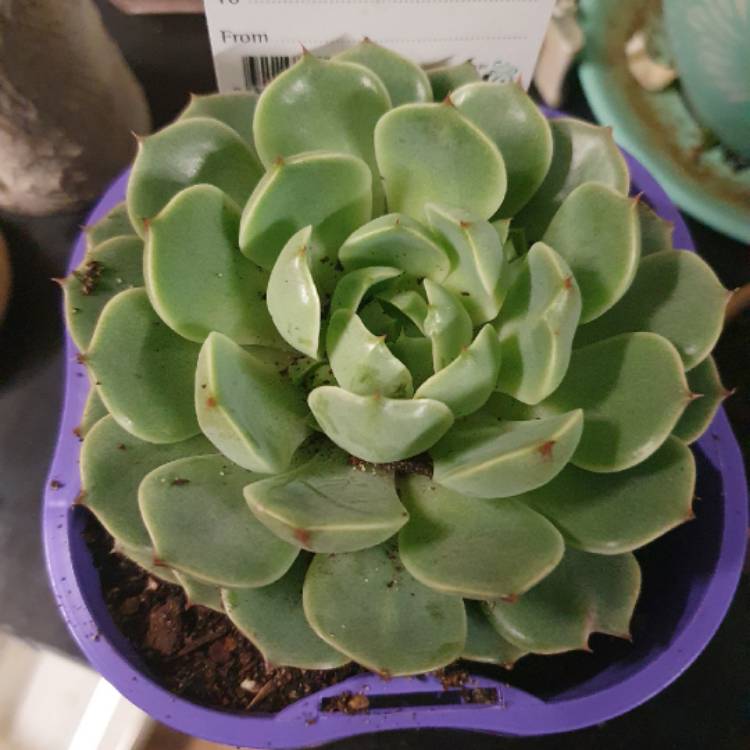
I want to click on blue plate, so click(x=710, y=62).